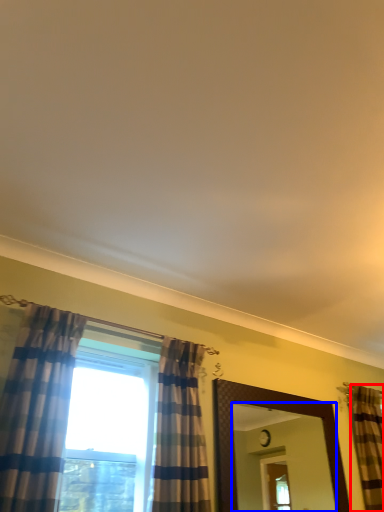
Question: Which object appears farthest to the camera in this image, curtain (highlighted by a red box) or mirror (highlighted by a blue box)?

Choices:
 (A) curtain
 (B) mirror

Answer: (A)